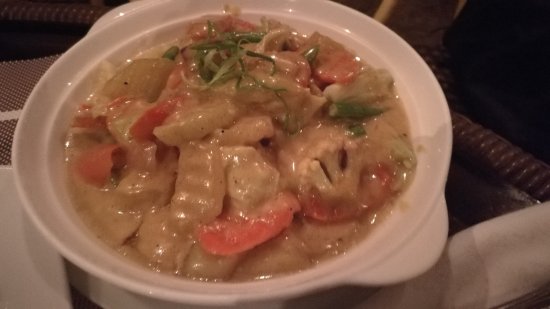
This screenshot has height=309, width=550. What are the coordinates of `weave seat of chair to the right` in the screenshot? It's located at (488, 135).